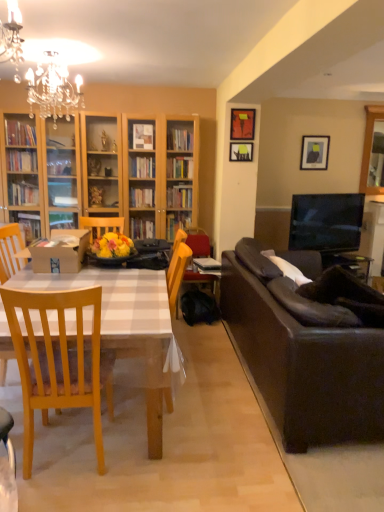
Question: Considering the relative sizes of crystal chandelier at upper left and wooden picture frame at upper center, which appears as the second picture frame when viewed from the front, in the image provided, is crystal chandelier at upper left bigger than wooden picture frame at upper center, which appears as the second picture frame when viewed from the front,?

Choices:
 (A) no
 (B) yes

Answer: (B)

Question: From a real-world perspective, is crystal chandelier at upper left below wooden picture frame at upper center, the 1th picture frame from the left?

Choices:
 (A) yes
 (B) no

Answer: (B)

Question: Considering the relative sizes of crystal chandelier at upper left and wooden picture frame at upper center, the second picture frame viewed from the back, in the image provided, is crystal chandelier at upper left thinner than wooden picture frame at upper center, the second picture frame viewed from the back,?

Choices:
 (A) yes
 (B) no

Answer: (B)

Question: Is the depth of crystal chandelier at upper left less than that of wooden picture frame at upper center, the 1th picture frame from the left?

Choices:
 (A) no
 (B) yes

Answer: (B)

Question: Considering the relative positions of crystal chandelier at upper left and wooden picture frame at upper center, acting as the 3th picture frame starting from the right, in the image provided, is crystal chandelier at upper left to the left of wooden picture frame at upper center, acting as the 3th picture frame starting from the right, from the viewer's perspective?

Choices:
 (A) no
 (B) yes

Answer: (B)

Question: From a real-world perspective, is hardcover book at center above or below matte black picture frame at upper right, acting as the third picture frame starting from the left?

Choices:
 (A) above
 (B) below

Answer: (B)

Question: Looking at their shapes, would you say hardcover book at center is wider or thinner than matte black picture frame at upper right, which is the 1th picture frame from back to front?

Choices:
 (A) thin
 (B) wide

Answer: (B)

Question: Based on their sizes in the image, would you say hardcover book at center is bigger or smaller than matte black picture frame at upper right, which is the 1th picture frame from back to front?

Choices:
 (A) big
 (B) small

Answer: (B)

Question: Considering the relative positions of hardcover book at center and matte black picture frame at upper right, acting as the 1th picture frame starting from the right, in the image provided, is hardcover book at center to the left or to the right of matte black picture frame at upper right, acting as the 1th picture frame starting from the right,?

Choices:
 (A) left
 (B) right

Answer: (A)

Question: Considering the positions of hardcover book at center and matte orange picture frame at upper right, placed as the first picture frame when sorted from front to back, in the image, is hardcover book at center taller or shorter than matte orange picture frame at upper right, placed as the first picture frame when sorted from front to back,?

Choices:
 (A) short
 (B) tall

Answer: (A)

Question: Is hardcover book at center to the left or to the right of matte orange picture frame at upper right, arranged as the third picture frame when viewed from the back, in the image?

Choices:
 (A) left
 (B) right

Answer: (A)

Question: From the image's perspective, is hardcover book at center positioned above or below matte orange picture frame at upper right, marked as the 2th picture frame in a left-to-right arrangement?

Choices:
 (A) below
 (B) above

Answer: (A)

Question: Is point (220, 270) closer or farther from the camera than point (251, 135)?

Choices:
 (A) farther
 (B) closer

Answer: (B)

Question: Does point (210, 271) appear closer or farther from the camera than point (8, 257)?

Choices:
 (A) farther
 (B) closer

Answer: (A)

Question: From a real-world perspective, is hardcover book at center physically located above or below light wood chair at left?

Choices:
 (A) below
 (B) above

Answer: (B)